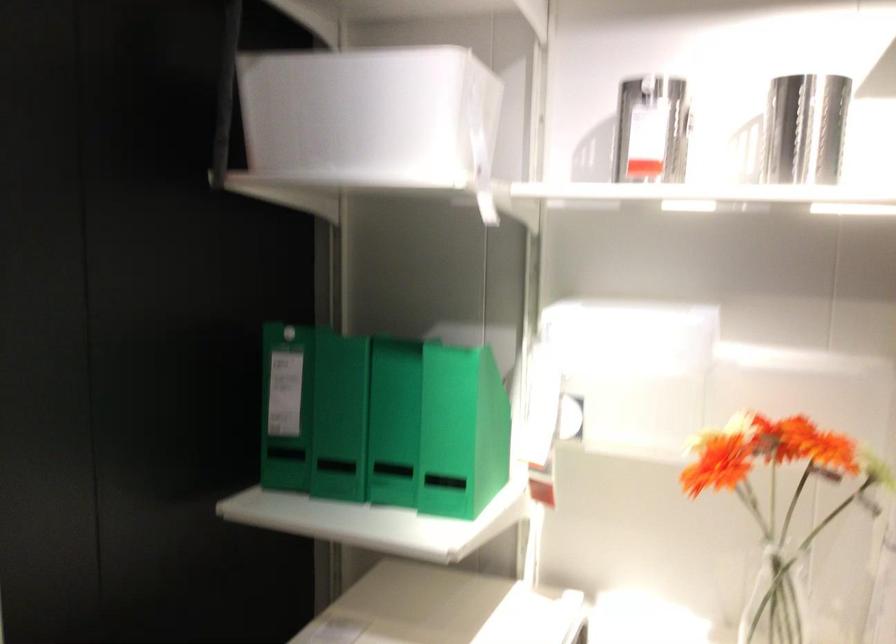
Locate an element on the screen. This screenshot has width=896, height=644. glass vase is located at coordinates (777, 600).